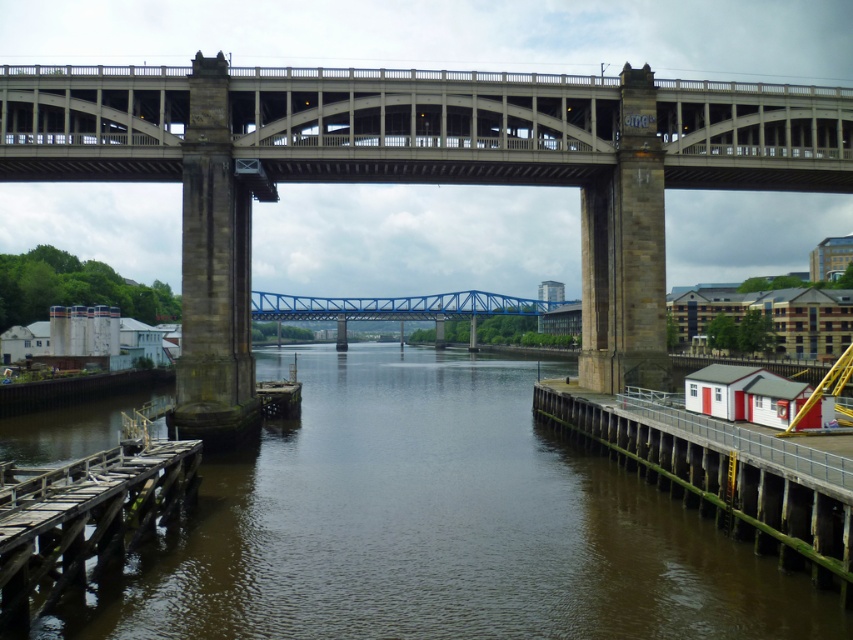
You are standing at the wooden dock on the left side of the river and want to take a photo of both point (322, 477) and point (86, 544). Which point should you focus on first to ensure both are in the frame?

You should focus on point (322, 477) first because it is closer to you than point (86, 544), ensuring both points remain in the frame.

You are a delivery truck driver who needs to cross the river to deliver goods to the industrial area on the right. The concrete bridge at center is closed for repairs. Can you use the white wooden dock at right as an alternative route? Explain why or why not based on their distance apart.

The concrete bridge at center and the white wooden dock at right are 25.03 meters apart. Since the white wooden dock at right is a dock designed for boats and not a road bridge, it cannot support the weight or provide a path for a delivery truck. The distance between them is irrelevant because the dock is not a viable crossing option for vehicles.

You are a boat captain trying to navigate through the river shown in the image. You need to pass between the brown muddy water at center and the wooden planks dock at lower left. Based on their positions, which direction should you steer your boat to avoid hitting the dock?

The brown muddy water at center is positioned on the left side of the wooden planks dock at lower left, so you should steer your boat to the right of the wooden planks dock at lower left to avoid collision.